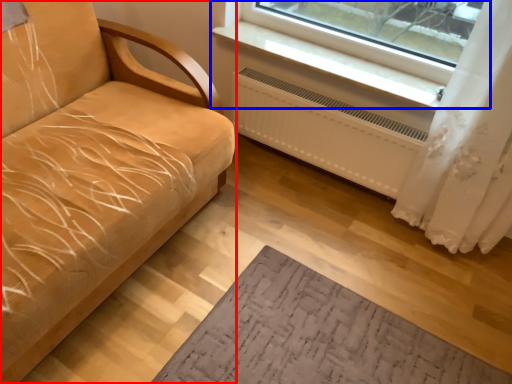
Question: Which point is further to the camera, studio couch (highlighted by a red box) or window (highlighted by a blue box)?

Choices:
 (A) studio couch
 (B) window

Answer: (B)